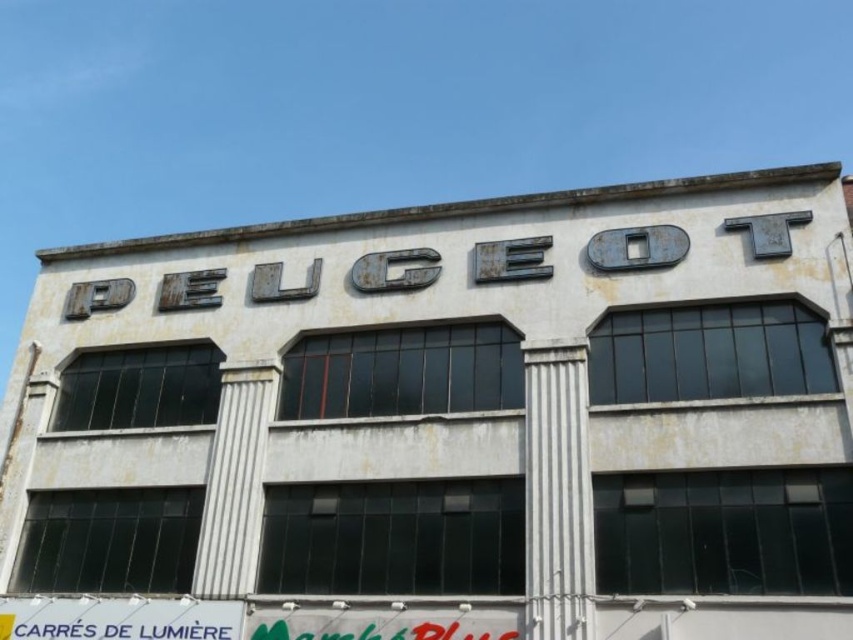
You are standing in front of the building and want to read both the white faded sign at center and the white plastic sign at lower left. Which sign should you look to your left to see?

The white plastic sign at lower left is on the left side of the white faded sign at center, so you should look to your left to see the white plastic sign at lower left.

You are standing in front of the building and want to locate the white faded sign at center. According to the coordinates provided, where exactly is the white faded sign positioned on the building facade?

The white faded sign at center is located at point coordinates of 0.653 on the x axis and 0.532 on the y axis.